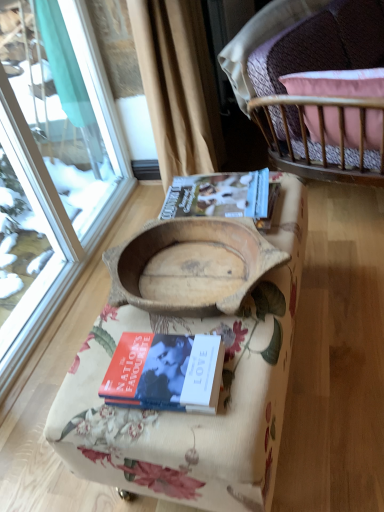
This screenshot has height=512, width=384. I want to click on vacant space situated above hardcover book at center, marked as the 2th book in a top-to-bottom arrangement (from a real-world perspective), so click(157, 362).